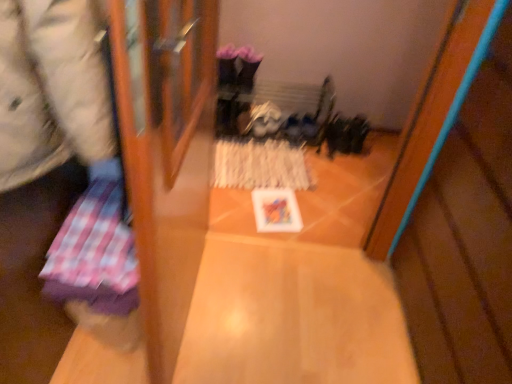
Question: From the image's perspective, is plaid fabric at left, placed as the 2th wrapping paper when sorted from right to left, above wooden table at center?

Choices:
 (A) no
 (B) yes

Answer: (B)

Question: Is plaid fabric at left, the second wrapping paper from the back, taller than wooden table at center?

Choices:
 (A) no
 (B) yes

Answer: (B)

Question: From the image's perspective, is plaid fabric at left, acting as the first wrapping paper starting from the left, beneath wooden table at center?

Choices:
 (A) yes
 (B) no

Answer: (B)

Question: Is plaid fabric at left, acting as the first wrapping paper starting from the left, far from wooden table at center?

Choices:
 (A) no
 (B) yes

Answer: (A)

Question: From a real-world perspective, is plaid fabric at left, placed as the second wrapping paper when sorted from top to bottom, positioned under wooden table at center based on gravity?

Choices:
 (A) yes
 (B) no

Answer: (B)

Question: From the image's perspective, is wooden table at center above or below plaid fabric at left, the first wrapping paper ordered from the bottom?

Choices:
 (A) above
 (B) below

Answer: (B)

Question: From a real-world perspective, relative to plaid fabric at left, which appears as the first wrapping paper when viewed from the front, is wooden table at center vertically above or below?

Choices:
 (A) below
 (B) above

Answer: (A)

Question: Is wooden table at center situated inside plaid fabric at left, placed as the second wrapping paper when sorted from top to bottom, or outside?

Choices:
 (A) outside
 (B) inside

Answer: (A)

Question: Considering the positions of point (280, 261) and point (91, 192), is point (280, 261) closer or farther from the camera than point (91, 192)?

Choices:
 (A) closer
 (B) farther

Answer: (B)

Question: Which is correct: wooden table at center is inside plaid fabric at left, or outside of it?

Choices:
 (A) outside
 (B) inside

Answer: (A)

Question: From a real-world perspective, relative to plaid fabric at left, is wooden table at center vertically above or below?

Choices:
 (A) above
 (B) below

Answer: (B)

Question: From the image's perspective, is wooden table at center positioned above or below plaid fabric at left?

Choices:
 (A) below
 (B) above

Answer: (A)

Question: In terms of size, does wooden table at center appear bigger or smaller than plaid fabric at left?

Choices:
 (A) big
 (B) small

Answer: (B)

Question: Based on their positions, is white textured paper at center, which appears as the first wrapping paper when viewed from the top, located to the left or right of wooden table at center?

Choices:
 (A) right
 (B) left

Answer: (A)

Question: From a real-world perspective, is white textured paper at center, positioned as the first wrapping paper in back-to-front order, above or below wooden table at center?

Choices:
 (A) above
 (B) below

Answer: (A)